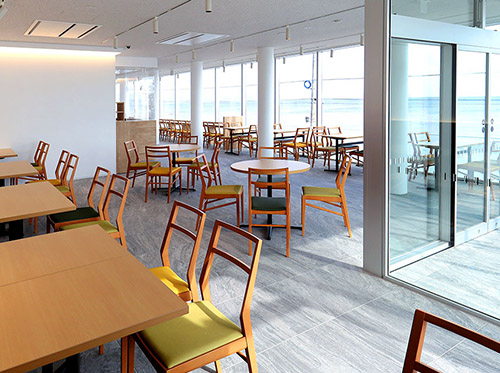
What are the coordinates of `support columns` in the screenshot? It's located at (401, 98), (267, 102), (192, 102), (151, 102), (122, 96).